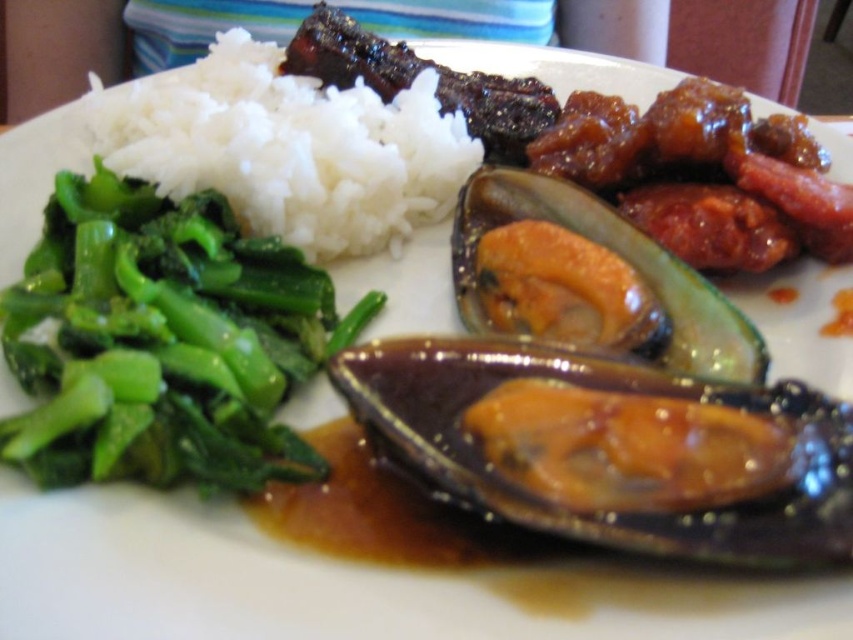
You are a customer at a restaurant looking at the plate. You want to pick up the food item located at point (248, 296). Will your hand block the view of the food item at point (492, 195) when you reach for it?

Yes, because point (248, 296) is in front of point (492, 195), so reaching for the former would block the view of the latter.

You are a food critic evaluating this dish. You need to taste both the shiny brown oyster at center and the shiny orange shell at center. How far apart are these two items on the plate?

The distance between the shiny brown oyster at center and the shiny orange shell at center is 7.31 inches.

You are a food critic standing at the table. You want to pick up the shiny brown oyster at center with your chopsticks. If you are facing the plate from the front, which direction should you move your chopsticks to reach it?

Since the shiny brown oyster at center is located at coordinates approximately 0.700 on the x and 0.720 on the y axis, you should move your chopsticks to the lower right direction to reach it.